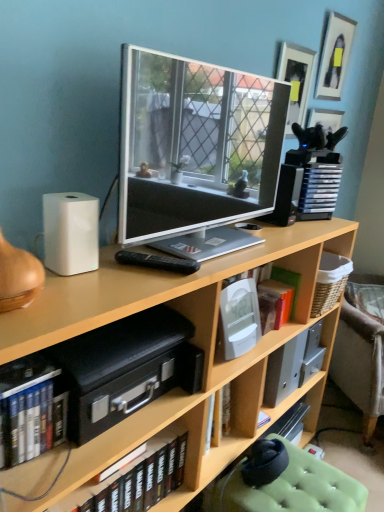
This screenshot has height=512, width=384. What are the coordinates of `free space above black matte printer at lower center (from a real-world perspective)` in the screenshot? It's located at (127, 331).